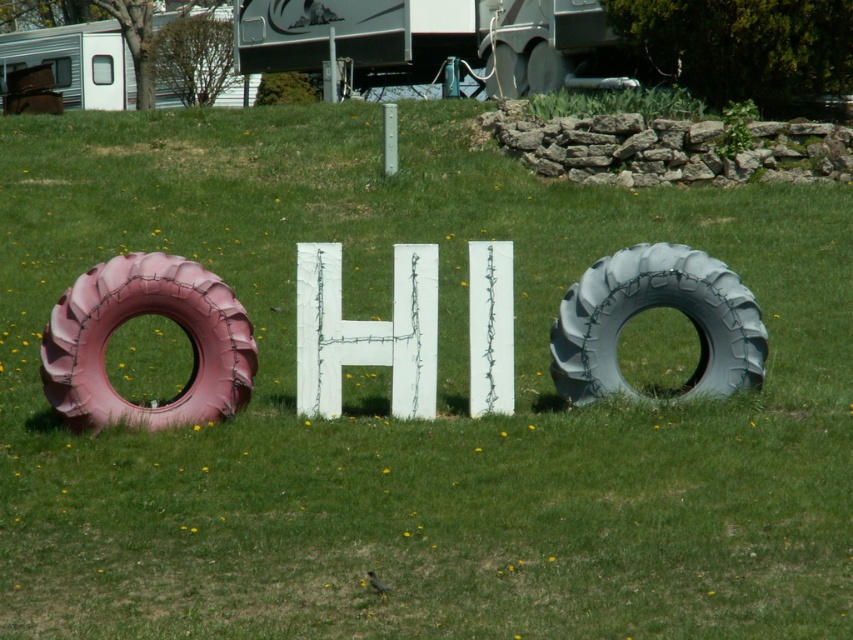
Who is higher up, white cracked wood letter h at center or white plastic trailer at upper left?

Positioned higher is white plastic trailer at upper left.

Is white cracked wood letter h at center wider than white plastic trailer at upper left?

No, white cracked wood letter h at center is not wider than white plastic trailer at upper left.

This screenshot has width=853, height=640. What are the coordinates of `white cracked wood letter h at center` in the screenshot? It's located at tap(366, 332).

Between brushed metal trailer at upper center and gray rubber tire at right, which one has less height?

With less height is brushed metal trailer at upper center.

Does point (357, 36) come closer to viewer compared to point (669, 257)?

No.

I want to click on brushed metal trailer at upper center, so click(x=432, y=40).

This screenshot has height=640, width=853. In order to click on brushed metal trailer at upper center in this screenshot , I will do `click(432, 40)`.

Can you confirm if pink rubber tire at left is positioned below white painted wood sign at center?

Correct, pink rubber tire at left is located below white painted wood sign at center.

Which of these two, pink rubber tire at left or white painted wood sign at center, stands taller?

white painted wood sign at center is taller.

Is point (68, 330) farther from viewer compared to point (512, 300)?

No, (68, 330) is in front of (512, 300).

In order to click on pink rubber tire at left in this screenshot , I will do `click(143, 314)`.